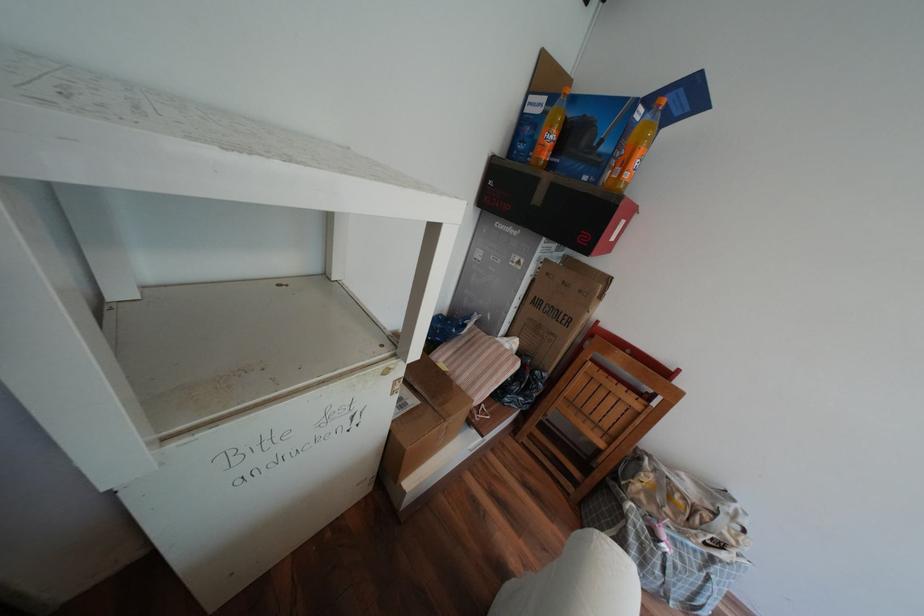
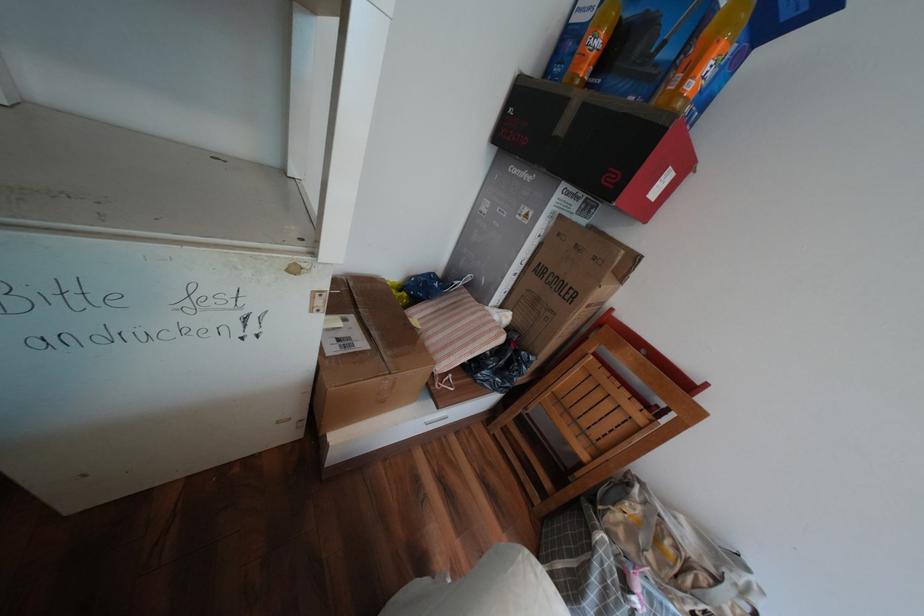
In a continuous first-person perspective shot, in which direction is the camera moving?

The cameraman walked toward right, forward.